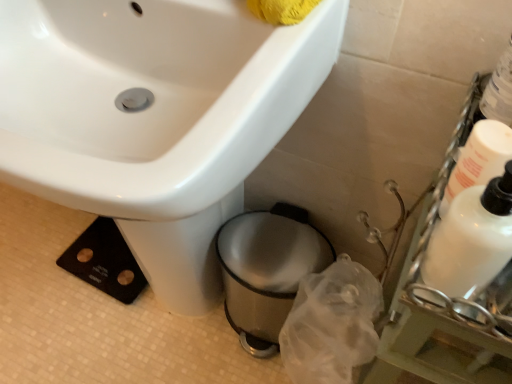
Question: Is white glossy sink at upper left in front of or behind white glossy bottle at right, the 1th cleaning product when ordered from right to left, in the image?

Choices:
 (A) front
 (B) behind

Answer: (A)

Question: Based on their positions, is white glossy sink at upper left located to the left or right of white glossy bottle at right, the 1th cleaning product when ordered from right to left?

Choices:
 (A) right
 (B) left

Answer: (B)

Question: Estimate the real-world distances between objects in this image. Which object is farther from the shiny metallic trash can at lower center?

Choices:
 (A) white glossy bottle at right, the 1th cleaning product when ordered from left to right
 (B) white glossy bottle at right, the 1th cleaning product when ordered from right to left
 (C) white glossy sink at upper left

Answer: (B)

Question: Which of these objects is positioned farthest from the white glossy bottle at right, the second cleaning product viewed from the left?

Choices:
 (A) white glossy bottle at right, acting as the 2th cleaning product starting from the right
 (B) shiny metallic trash can at lower center
 (C) white glossy sink at upper left

Answer: (B)